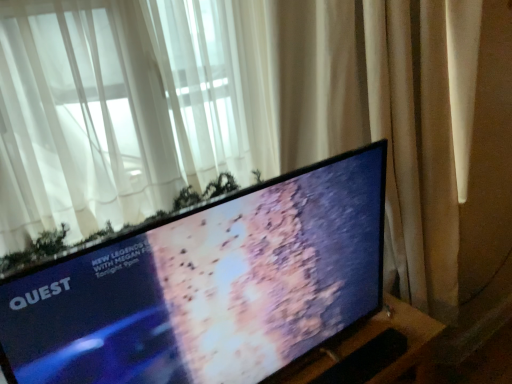
Question: Does black matte keyboard at lower center have a greater height compared to white sheer curtain at upper left, the first curtain when ordered from left to right?

Choices:
 (A) no
 (B) yes

Answer: (A)

Question: Are black matte keyboard at lower center and white sheer curtain at upper left, the 2th curtain viewed from the right, making contact?

Choices:
 (A) yes
 (B) no

Answer: (B)

Question: From a real-world perspective, is black matte keyboard at lower center beneath white sheer curtain at upper left, the 2th curtain viewed from the right?

Choices:
 (A) no
 (B) yes

Answer: (B)

Question: Is black matte keyboard at lower center in front of white sheer curtain at upper left, the first curtain when ordered from left to right?

Choices:
 (A) no
 (B) yes

Answer: (A)

Question: From a real-world perspective, is black matte keyboard at lower center located higher than white sheer curtain at upper left, the 2th curtain viewed from the right?

Choices:
 (A) no
 (B) yes

Answer: (A)

Question: Would you say beige fabric curtain at right, which is the 1th curtain in right-to-left order, is inside or outside black matte keyboard at lower center?

Choices:
 (A) inside
 (B) outside

Answer: (B)

Question: Looking at their shapes, would you say beige fabric curtain at right, which is the 1th curtain in right-to-left order, is wider or thinner than black matte keyboard at lower center?

Choices:
 (A) thin
 (B) wide

Answer: (B)

Question: Does point (413, 109) appear closer or farther from the camera than point (379, 369)?

Choices:
 (A) closer
 (B) farther

Answer: (B)

Question: From the image's perspective, is beige fabric curtain at right, the second curtain in the left-to-right sequence, positioned above or below black matte keyboard at lower center?

Choices:
 (A) below
 (B) above

Answer: (B)

Question: Is black matte keyboard at lower center in front of or behind white sheer curtain at upper left, the 2th curtain viewed from the right, in the image?

Choices:
 (A) front
 (B) behind

Answer: (B)

Question: From the image's perspective, is black matte keyboard at lower center positioned above or below white sheer curtain at upper left, the 2th curtain viewed from the right?

Choices:
 (A) below
 (B) above

Answer: (A)

Question: Is black matte keyboard at lower center bigger or smaller than white sheer curtain at upper left, the 2th curtain viewed from the right?

Choices:
 (A) big
 (B) small

Answer: (B)

Question: From a real-world perspective, is black matte keyboard at lower center positioned above or below white sheer curtain at upper left, the 2th curtain viewed from the right?

Choices:
 (A) above
 (B) below

Answer: (B)

Question: Looking at their shapes, would you say beige fabric curtain at right, the second curtain in the left-to-right sequence, is wider or thinner than matte black tv at center?

Choices:
 (A) wide
 (B) thin

Answer: (A)

Question: Is point (410, 109) positioned closer to the camera than point (202, 261)?

Choices:
 (A) farther
 (B) closer

Answer: (A)